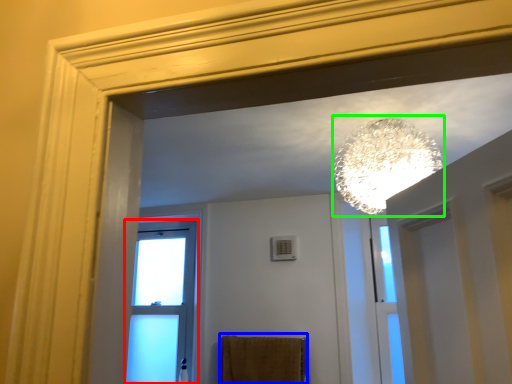
Question: Estimate the real-world distances between objects in this image. Which object is farther from window (highlighted by a red box), bath towel (highlighted by a blue box) or lamp (highlighted by a green box)?

Choices:
 (A) bath towel
 (B) lamp

Answer: (B)